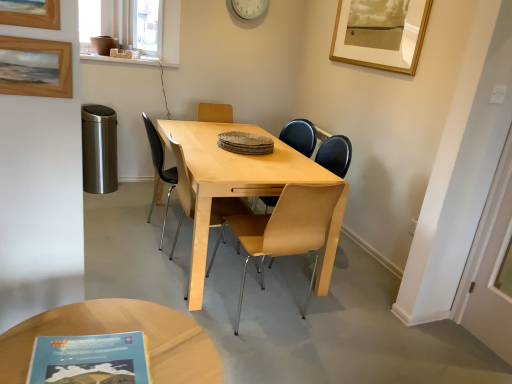
Question: Is white plastic clock at upper center touching wooden framed artwork at upper right, arranged as the third picture frame when ordered from the bottom?

Choices:
 (A) no
 (B) yes

Answer: (A)

Question: Does white plastic clock at upper center have a smaller size compared to wooden framed artwork at upper right, which appears as the 1th picture frame when viewed from the top?

Choices:
 (A) no
 (B) yes

Answer: (B)

Question: Does white plastic clock at upper center have a lesser height compared to wooden framed artwork at upper right, arranged as the third picture frame when ordered from the bottom?

Choices:
 (A) yes
 (B) no

Answer: (A)

Question: Is white plastic clock at upper center outside wooden framed artwork at upper right, the third picture frame in the left-to-right sequence?

Choices:
 (A) yes
 (B) no

Answer: (A)

Question: Considering the relative positions of white plastic clock at upper center and wooden framed artwork at upper right, which appears as the third picture frame when viewed from the front, in the image provided, is white plastic clock at upper center to the right of wooden framed artwork at upper right, which appears as the third picture frame when viewed from the front, from the viewer's perspective?

Choices:
 (A) yes
 (B) no

Answer: (B)

Question: Is wooden framed artwork at upper right, arranged as the third picture frame when ordered from the bottom, surrounded by white plastic clock at upper center?

Choices:
 (A) no
 (B) yes

Answer: (A)

Question: Is transparent plastic window screen at upper left located within light brown wooden coffee table at lower left?

Choices:
 (A) no
 (B) yes

Answer: (A)

Question: Is light brown wooden coffee table at lower left far from transparent plastic window screen at upper left?

Choices:
 (A) yes
 (B) no

Answer: (A)

Question: Considering the relative sizes of light brown wooden coffee table at lower left and transparent plastic window screen at upper left in the image provided, is light brown wooden coffee table at lower left smaller than transparent plastic window screen at upper left?

Choices:
 (A) no
 (B) yes

Answer: (A)

Question: From a real-world perspective, is light brown wooden coffee table at lower left positioned over transparent plastic window screen at upper left based on gravity?

Choices:
 (A) yes
 (B) no

Answer: (B)

Question: Is light brown wooden coffee table at lower left positioned with its back to transparent plastic window screen at upper left?

Choices:
 (A) no
 (B) yes

Answer: (B)

Question: From the image's perspective, is light brown wooden coffee table at lower left under transparent plastic window screen at upper left?

Choices:
 (A) yes
 (B) no

Answer: (A)

Question: From the image's perspective, would you say white plastic clock at upper center is shown under light brown leather chair at center, marked as the first chair in a front-to-back arrangement?

Choices:
 (A) no
 (B) yes

Answer: (A)